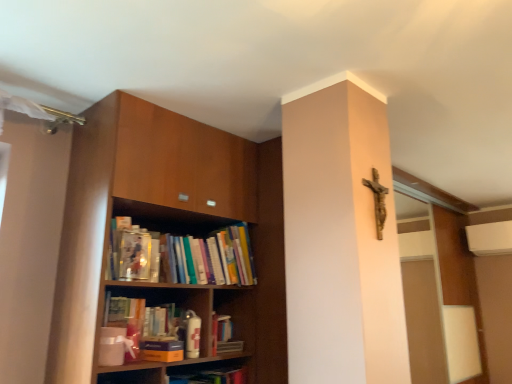
Where is `wooden bookshelf at left`? This screenshot has height=384, width=512. wooden bookshelf at left is located at coordinates (166, 221).

The height and width of the screenshot is (384, 512). What do you see at coordinates (166, 221) in the screenshot?
I see `wooden bookshelf at left` at bounding box center [166, 221].

The width and height of the screenshot is (512, 384). What do you see at coordinates (161, 350) in the screenshot?
I see `blue matte paperback book at lower center` at bounding box center [161, 350].

Image resolution: width=512 pixels, height=384 pixels. Identify the location of blue matte paperback book at lower center. (161, 350).

The width and height of the screenshot is (512, 384). Find the location of `wooden bookshelf at left`. wooden bookshelf at left is located at coordinates (166, 221).

Based on their positions, is wooden bookshelf at left located to the left or right of blue matte paperback book at lower center?

Clearly, wooden bookshelf at left is on the left of blue matte paperback book at lower center in the image.

Considering the positions of objects wooden bookshelf at left and blue matte paperback book at lower center in the image provided, who is in front, wooden bookshelf at left or blue matte paperback book at lower center?

wooden bookshelf at left is in front.

Considering the positions of point (106, 122) and point (154, 341), is point (106, 122) closer or farther from the camera than point (154, 341)?

Clearly, point (106, 122) is closer to the camera than point (154, 341).

From the image's perspective, is wooden bookshelf at left above or below blue matte paperback book at lower center?

wooden bookshelf at left is situated higher than blue matte paperback book at lower center in the image.

From a real-world perspective, between wooden bookshelf at left and blue matte paperback book at lower center, who is vertically lower?

blue matte paperback book at lower center.

Can you confirm if wooden bookshelf at left is thinner than blue matte paperback book at lower center?

No.

In terms of height, does wooden bookshelf at left look taller or shorter compared to blue matte paperback book at lower center?

Clearly, wooden bookshelf at left is taller compared to blue matte paperback book at lower center.

Does wooden bookshelf at left have a smaller size compared to blue matte paperback book at lower center?

No.

Is wooden bookshelf at left located outside blue matte paperback book at lower center?

wooden bookshelf at left lies outside blue matte paperback book at lower center's area.

Is wooden bookshelf at left not near blue matte paperback book at lower center?

They are positioned close to each other.

Is wooden bookshelf at left facing away from blue matte paperback book at lower center?

That's right, wooden bookshelf at left is facing away from blue matte paperback book at lower center.

Can you tell me how much wooden bookshelf at left and blue matte paperback book at lower center differ in facing direction?

The angle between the facing direction of wooden bookshelf at left and the facing direction of blue matte paperback book at lower center is 8.45 degrees.

Identify the location of shelf lying in front of the blue matte paperback book at lower center. (166, 221).

In the image, is blue matte paperback book at lower center on the left side or the right side of wooden bookshelf at left?

From the image, it's evident that blue matte paperback book at lower center is to the right of wooden bookshelf at left.

Looking at this image, between blue matte paperback book at lower center and wooden bookshelf at left, which one is positioned behind?

blue matte paperback book at lower center is behind.

Considering the points (145, 346) and (71, 218), which point is behind, point (145, 346) or point (71, 218)?

The point (71, 218) is behind.

Consider the image. From the image's perspective, between blue matte paperback book at lower center and wooden bookshelf at left, which one is located above?

wooden bookshelf at left is shown above in the image.

From a real-world perspective, is blue matte paperback book at lower center physically below wooden bookshelf at left?

Yes, from a real-world perspective, blue matte paperback book at lower center is below wooden bookshelf at left.

Considering the sizes of objects blue matte paperback book at lower center and wooden bookshelf at left in the image provided, who is wider, blue matte paperback book at lower center or wooden bookshelf at left?

wooden bookshelf at left.

Considering the sizes of blue matte paperback book at lower center and wooden bookshelf at left in the image, is blue matte paperback book at lower center taller or shorter than wooden bookshelf at left?

blue matte paperback book at lower center is shorter than wooden bookshelf at left.

Can you confirm if blue matte paperback book at lower center is bigger than wooden bookshelf at left?

Actually, blue matte paperback book at lower center might be smaller than wooden bookshelf at left.

Is blue matte paperback book at lower center inside or outside of wooden bookshelf at left?

blue matte paperback book at lower center is contained in wooden bookshelf at left.

Are blue matte paperback book at lower center and wooden bookshelf at left beside each other?

No, blue matte paperback book at lower center is not next to wooden bookshelf at left.

Based on the photo, is blue matte paperback book at lower center turned away from wooden bookshelf at left?

Yes, blue matte paperback book at lower center is facing away from wooden bookshelf at left.

Identify the location of shelf in front of the blue matte paperback book at lower center. Image resolution: width=512 pixels, height=384 pixels. (166, 221).

Image resolution: width=512 pixels, height=384 pixels. Find the location of `paperback book below the wooden bookshelf at left (from the image's perspective)`. paperback book below the wooden bookshelf at left (from the image's perspective) is located at coordinates (161, 350).

Locate an element on the screen. The width and height of the screenshot is (512, 384). paperback book that is under the wooden bookshelf at left (from a real-world perspective) is located at coordinates (x=161, y=350).